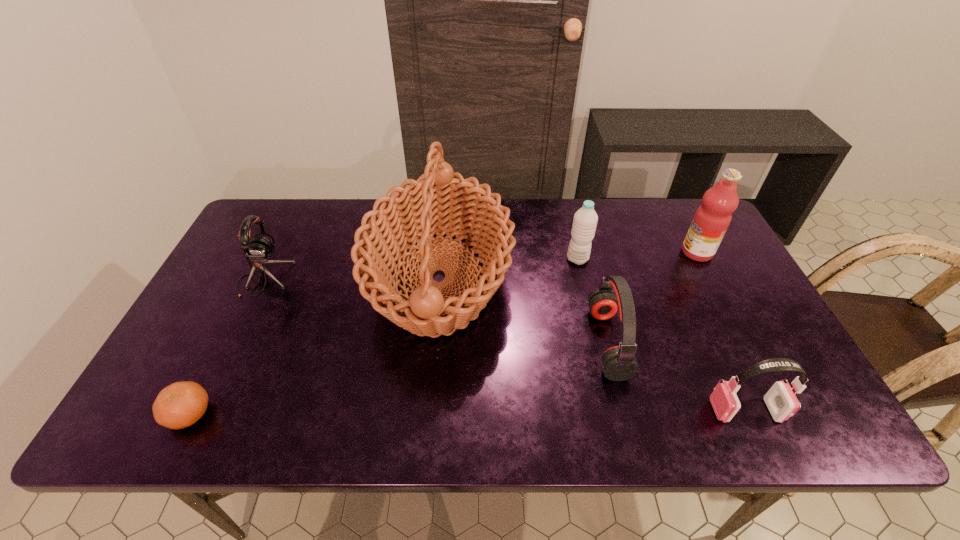
This screenshot has width=960, height=540. Find the location of `basket`. basket is located at coordinates (441, 203).

Locate an element on the screen. The width and height of the screenshot is (960, 540). the tallest object is located at coordinates (441, 203).

The width and height of the screenshot is (960, 540). Find the location of `fruit juice`. fruit juice is located at coordinates (712, 219).

Identify the location of water bottle. The height and width of the screenshot is (540, 960). (585, 220).

This screenshot has height=540, width=960. Find the location of `the farthest earphone`. the farthest earphone is located at coordinates (259, 250).

Find the location of a particular element. The image size is (960, 540). the second earphone from left to right is located at coordinates (619, 363).

This screenshot has height=540, width=960. What are the coordinates of `the nearest earphone` in the screenshot? It's located at (782, 403).

Image resolution: width=960 pixels, height=540 pixels. I want to click on the shortest object, so click(x=181, y=404).

The image size is (960, 540). What are the coordinates of `vacant space located on the right of the basket` in the screenshot? It's located at (544, 279).

Where is `free space located on the label of the sixth shortest object`? The height and width of the screenshot is (540, 960). free space located on the label of the sixth shortest object is located at coordinates (556, 252).